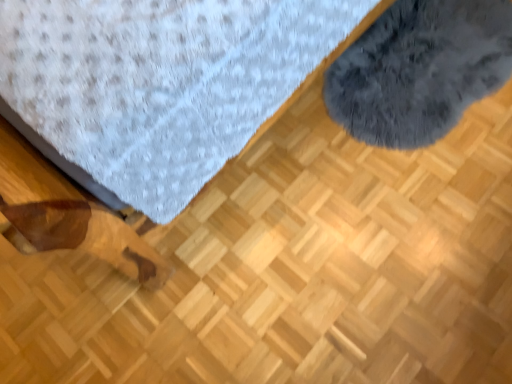
Where is `free location in front of dark gray fluffy rug at upper right`? free location in front of dark gray fluffy rug at upper right is located at coordinates (416, 218).